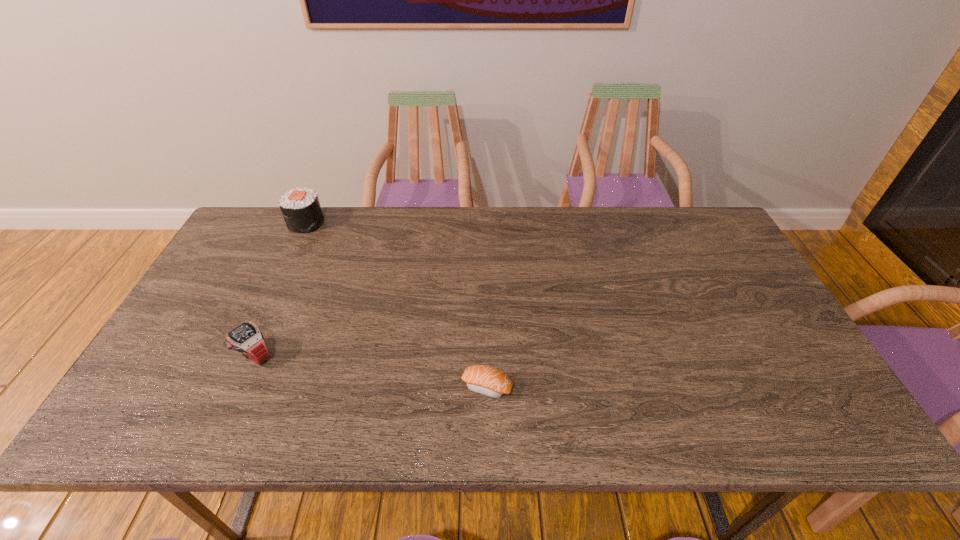
Locate an element on the screen. object at the left edge is located at coordinates (301, 209).

Identify the location of object that is at the far left corner. (301, 209).

Identify the location of vacant space at the far edge. The width and height of the screenshot is (960, 540). (641, 226).

This screenshot has height=540, width=960. In the image, there is a desktop. Identify the location of vacant space at the near edge. (726, 408).

Find the location of a particular element. blank space at the right edge is located at coordinates (718, 318).

I want to click on vacant region at the far right corner of the desktop, so click(713, 219).

This screenshot has height=540, width=960. I want to click on free space at the near right corner of the desktop, so click(789, 423).

Where is `vacant area that lies between the farther sushi and the second shortest object`? This screenshot has height=540, width=960. vacant area that lies between the farther sushi and the second shortest object is located at coordinates (280, 289).

Where is `vacant area between the second shortest object and the farthest object`? The image size is (960, 540). vacant area between the second shortest object and the farthest object is located at coordinates (280, 289).

Where is `free point between the farther sushi and the second nearest object`? free point between the farther sushi and the second nearest object is located at coordinates (280, 289).